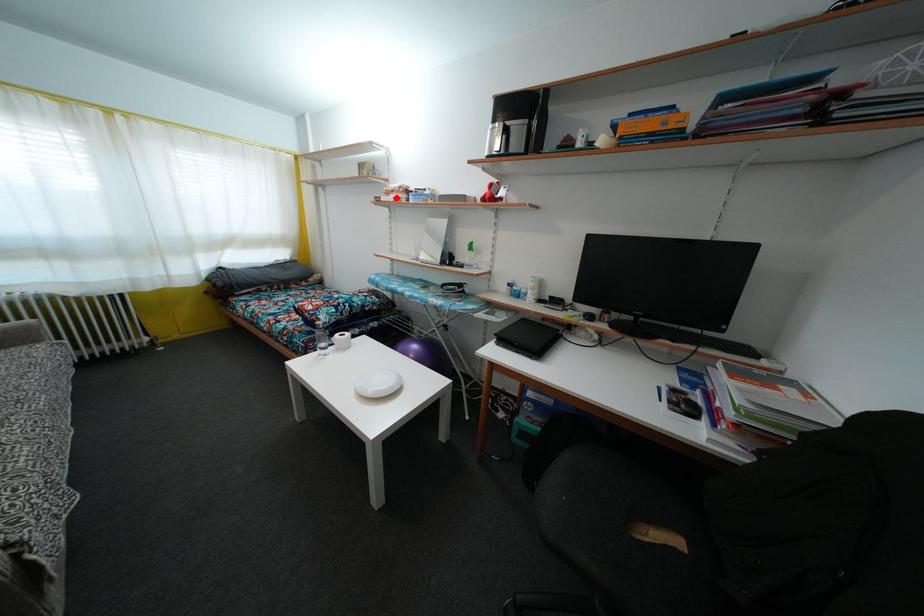
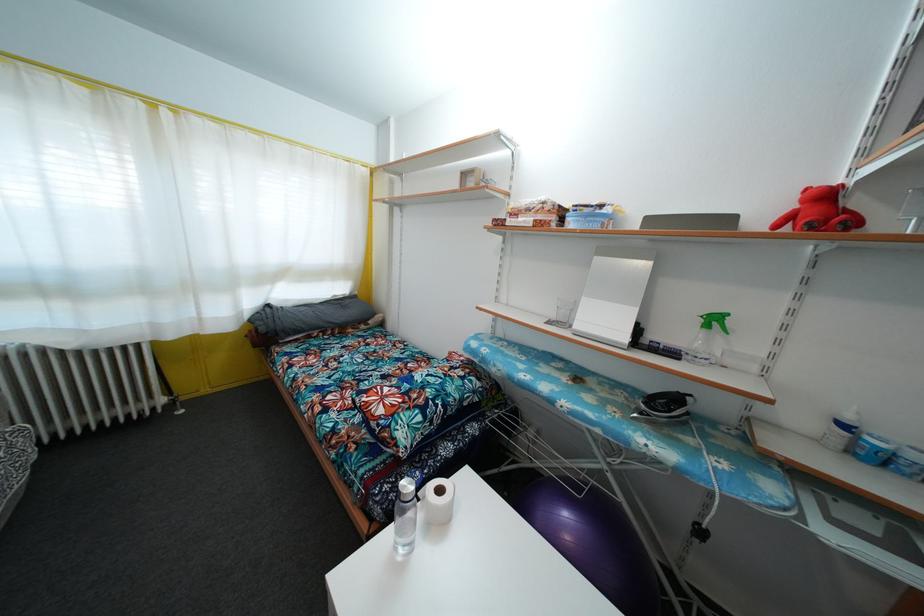
Find the pixel in the second image that matches the highlighted location in the first image.

(531, 216)